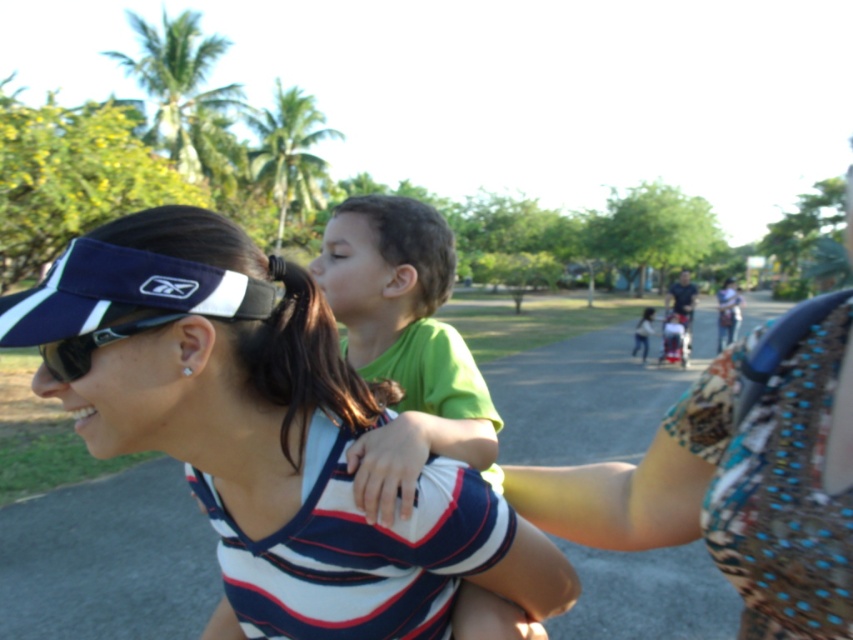
Question: Which of the following is the closest to the observer?

Choices:
 (A) (639, 499)
 (B) (456, 515)
 (C) (142, 272)

Answer: (C)

Question: Which object appears farthest from the camera in this image?

Choices:
 (A) green matte shirt at center
 (B) polka dot fabric at center

Answer: (A)

Question: Does green matte shirt at center have a greater width compared to navy blue fabric visor at upper left?

Choices:
 (A) no
 (B) yes

Answer: (B)

Question: In this image, where is green matte shirt at center located relative to navy blue fabric visor at upper left?

Choices:
 (A) below
 (B) above

Answer: (A)

Question: Is green matte shirt at center positioned in front of polka dot fabric at center?

Choices:
 (A) yes
 (B) no

Answer: (B)

Question: Which object is closer to the camera taking this photo?

Choices:
 (A) navy blue fabric visor at upper left
 (B) polka dot fabric at center
 (C) green matte shirt at center
 (D) sunglasses at left

Answer: (B)